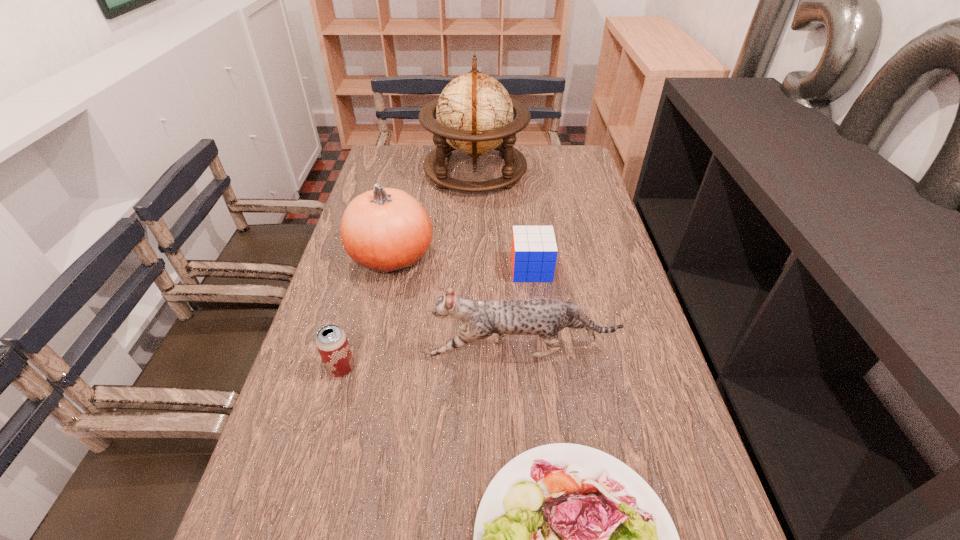
At what (x,y) coordinates should I click in order to perform the action: click on free point at the far left corner. Please return your answer as a coordinate pair (x, y). This screenshot has width=960, height=540. Looking at the image, I should click on (399, 166).

This screenshot has height=540, width=960. In order to click on blank area at the far right corner in this screenshot , I will do `click(562, 148)`.

The height and width of the screenshot is (540, 960). What are the coordinates of `free space between the second tallest object and the farthest object` in the screenshot? It's located at (433, 213).

Find the location of a particular element. The width and height of the screenshot is (960, 540). vacant region between the pumpkin and the beer can is located at coordinates (367, 312).

At what (x,y) coordinates should I click in order to perform the action: click on vacant space that's between the cube and the pumpkin. Please return your answer as a coordinate pair (x, y). The image size is (960, 540). Looking at the image, I should click on coord(462,262).

Locate an element on the screen. vacant region between the beer can and the pumpkin is located at coordinates (367, 312).

Where is `free point between the beer can and the third tallest object`? The height and width of the screenshot is (540, 960). free point between the beer can and the third tallest object is located at coordinates (432, 360).

Choose which object is the fourth nearest neighbor to the globe. Please provide its 2D coordinates. Your answer should be formatted as a tuple, i.e. [(x, y)], where the tuple contains the x and y coordinates of a point satisfying the conditions above.

[(331, 340)]

Select which object appears as the closest to the cube. Please provide its 2D coordinates. Your answer should be formatted as a tuple, i.e. [(x, y)], where the tuple contains the x and y coordinates of a point satisfying the conditions above.

[(545, 317)]

You are a GUI agent. You are given a task and a screenshot of the screen. Output one action in this format:
    pyautogui.click(x=<x>, y=<y>)
    Task: Click on the vacant region that satisfies the following two spatial constraints: 1. on the face of the cat; 2. on the front side of the beer can
    Image resolution: width=960 pixels, height=540 pixels.
    Given the screenshot: What is the action you would take?
    pyautogui.click(x=524, y=368)